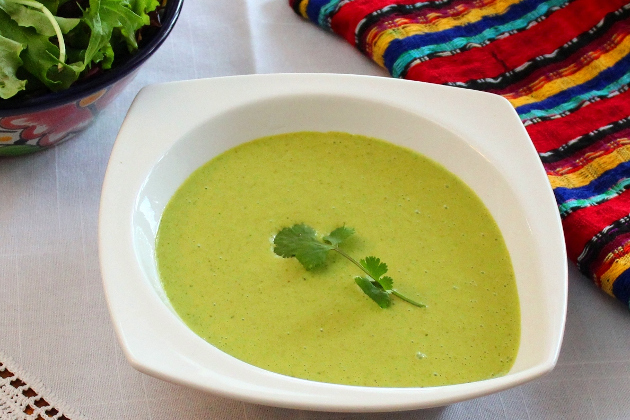
Identify the location of bowl. The width and height of the screenshot is (630, 420). (494, 146).